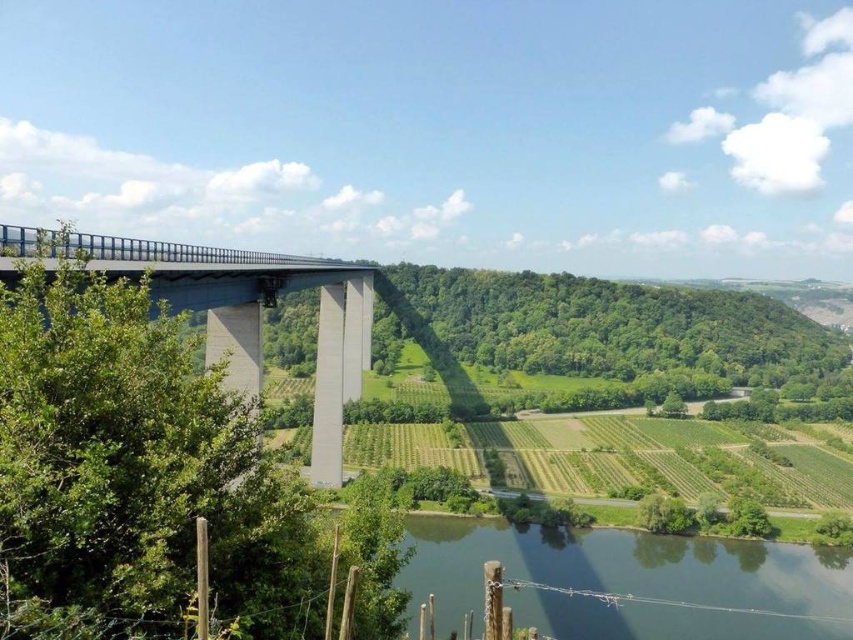
You are a drone operator planning to fly a drone from the concrete bridge at left to the green smooth water at lower center. The drone has a maximum flight range of 50 meters. Can the drone safely reach the water without needing to recharge?

The distance between the green smooth water at lower center and the concrete bridge at left is 54.44 meters, which exceeds the drone s 50 meter range. Therefore, the drone cannot safely reach the water without recharging.

You are standing at the base of the bridge and want to reach a specific point marked at coordinate point (x=601, y=541). If your maximum walking distance is 400 feet, can you reach that point without exceeding your limit?

The distance between you and the point (x=601, y=541) is 350.86 feet, which is within your 400 feet limit. Yes, you can reach it without exceeding your limit.

You are a drone operator tasked with capturing aerial footage of the scenic landscape. The drone must avoid flying over the green smooth water at lower center to prevent interference with the reflections. Given that the drone is currently at coordinates point A, which is at the bridge, can you determine if the drone can safely fly to the valley fields without crossing the water?

The green smooth water at lower center is located at point (630, 580). Since the drone is starting at the bridge and needs to reach the valley fields, it can adjust its flight path to avoid the coordinates of the water, ensuring it stays over the fields or the bridge structure itself, thus avoiding the water area.